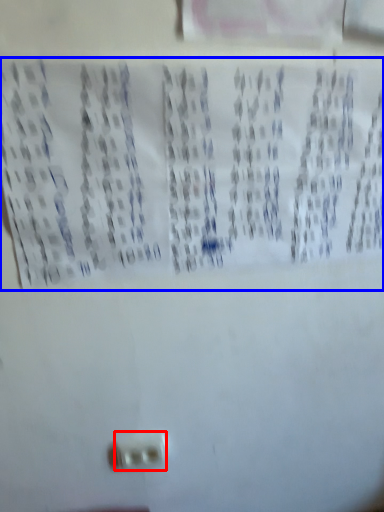
Question: Which of the following is the farthest to the observer, power plugs and sockets (highlighted by a red box) or print (highlighted by a blue box)?

Choices:
 (A) power plugs and sockets
 (B) print

Answer: (A)